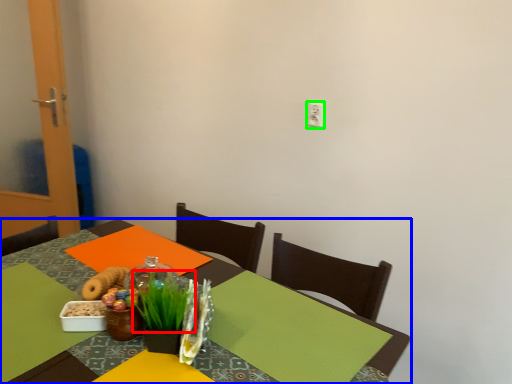
Question: Based on their relative distances, which object is nearer to grass (highlighted by a red box)? Choose from table (highlighted by a blue box) and electric outlet (highlighted by a green box).

Choices:
 (A) table
 (B) electric outlet

Answer: (A)